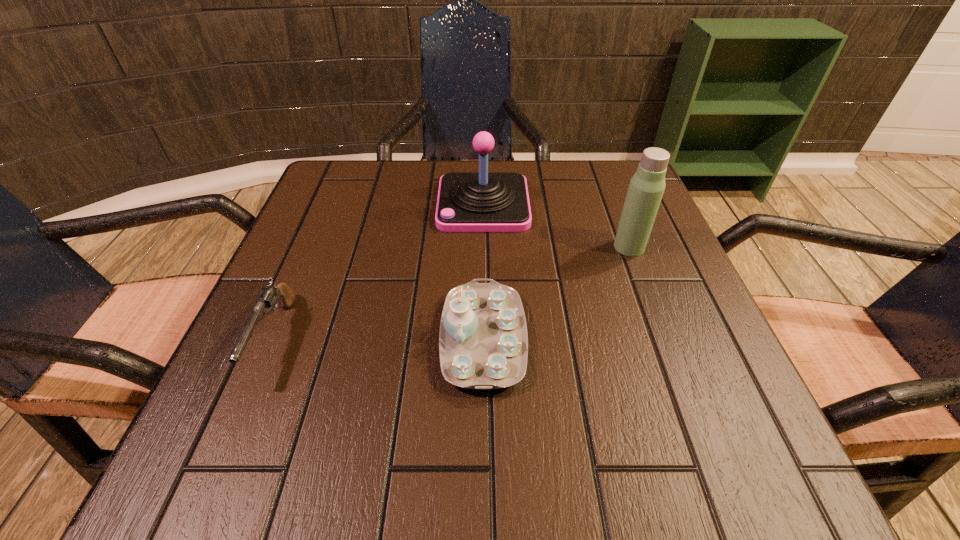
Image resolution: width=960 pixels, height=540 pixels. What are the coordinates of `the closest object to the farthest object` in the screenshot? It's located at (646, 187).

Locate an element on the screen. The height and width of the screenshot is (540, 960). the third closest object to the rightmost object is located at coordinates pyautogui.click(x=269, y=295).

Where is `blank area in the image that satisfies the following two spatial constraints: 1. forward from the base of the farthest object; 2. on the left side of the tallest object`? blank area in the image that satisfies the following two spatial constraints: 1. forward from the base of the farthest object; 2. on the left side of the tallest object is located at coordinates (484, 247).

Image resolution: width=960 pixels, height=540 pixels. In order to click on free space that satisfies the following two spatial constraints: 1. forward from the base of the farthest object; 2. on the right side of the second farthest object in this screenshot , I will do `click(484, 247)`.

Locate an element on the screen. This screenshot has width=960, height=540. free location that satisfies the following two spatial constraints: 1. forward from the base of the farthest object; 2. aiming along the barrel of the leftmost object is located at coordinates (485, 339).

Identify the location of vacant space that satisfies the following two spatial constraints: 1. forward from the base of the second farthest object; 2. on the left side of the farthest object. This screenshot has height=540, width=960. (484, 247).

The width and height of the screenshot is (960, 540). What are the coordinates of `free space that satisfies the following two spatial constraints: 1. forward from the base of the farthest object; 2. on the right side of the third nearest object` in the screenshot? It's located at (484, 247).

Identify the location of vacant point that satisfies the following two spatial constraints: 1. forward from the base of the farthest object; 2. on the front side of the chinaware. This screenshot has width=960, height=540. (485, 339).

The width and height of the screenshot is (960, 540). Identify the location of vacant position in the image that satisfies the following two spatial constraints: 1. aiming along the barrel of the chinaware; 2. on the left side of the gun. (275, 339).